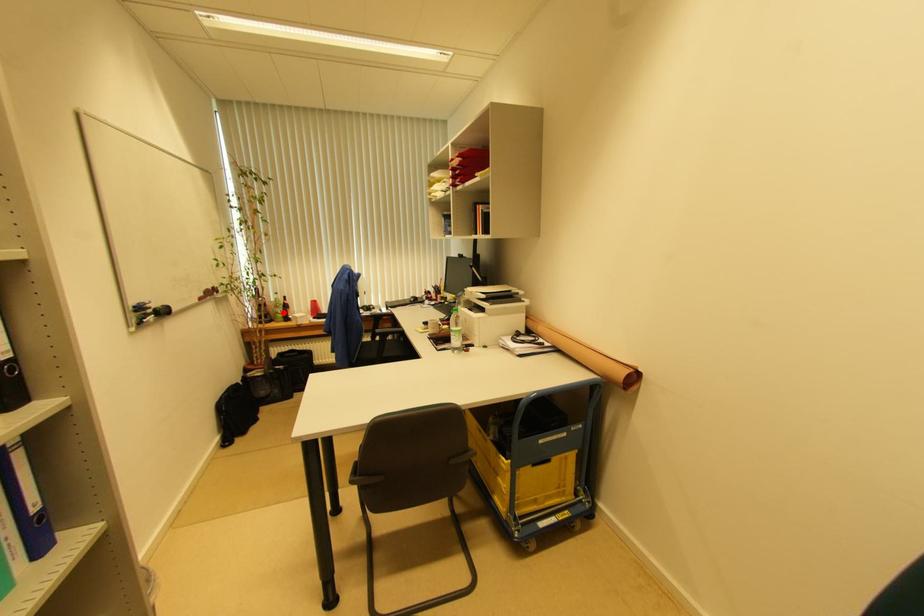
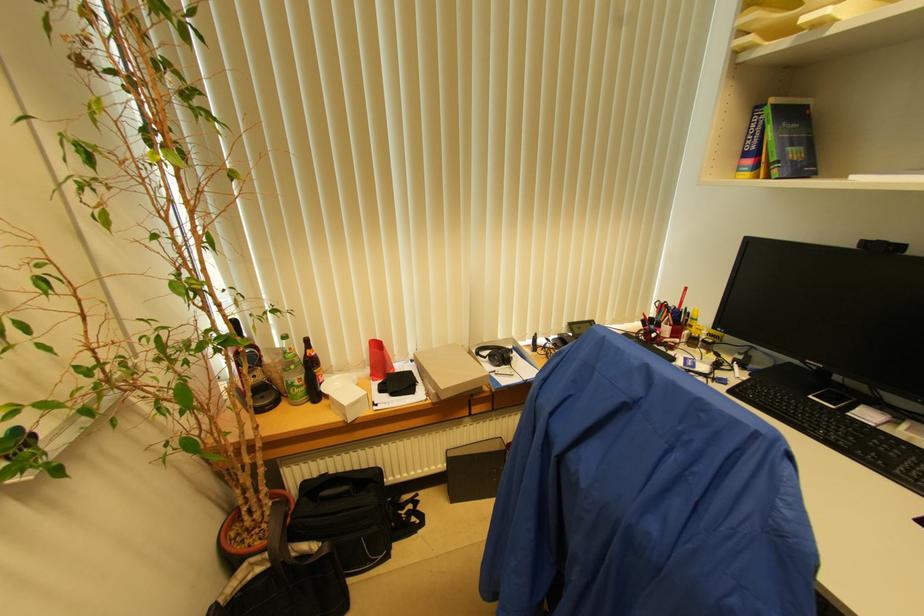
In the second image, find the point that corresponds to the highlighted location in the first image.

(304, 379)